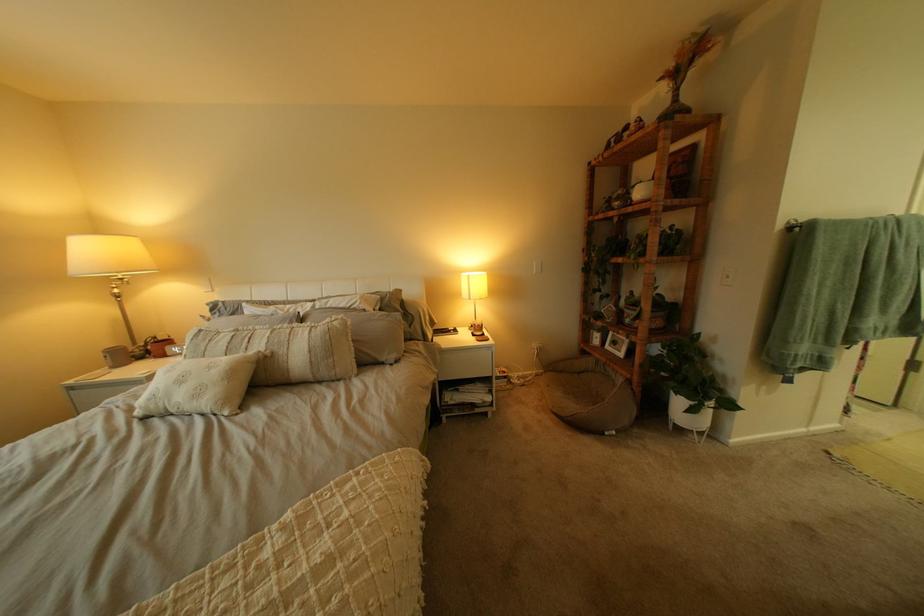
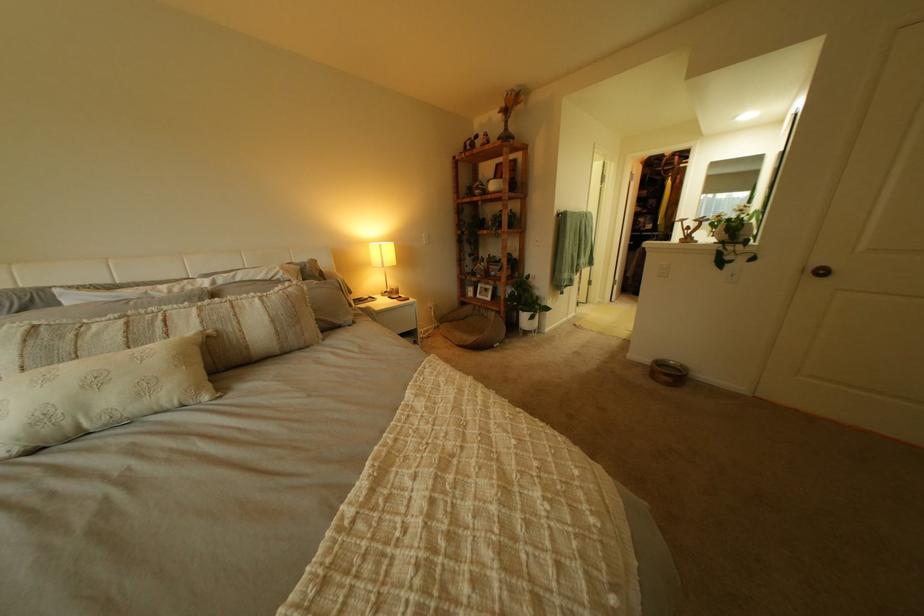
In the second image, find the point that corresponds to [472,274] in the first image.

(381, 244)